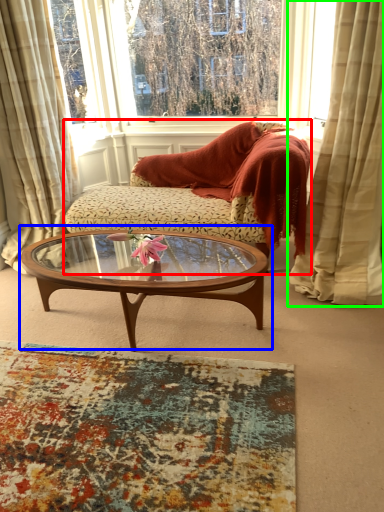
Question: Considering the real-world distances, which object is farthest from studio couch (highlighted by a red box)? coffee table (highlighted by a blue box) or curtain (highlighted by a green box)?

Choices:
 (A) coffee table
 (B) curtain

Answer: (B)